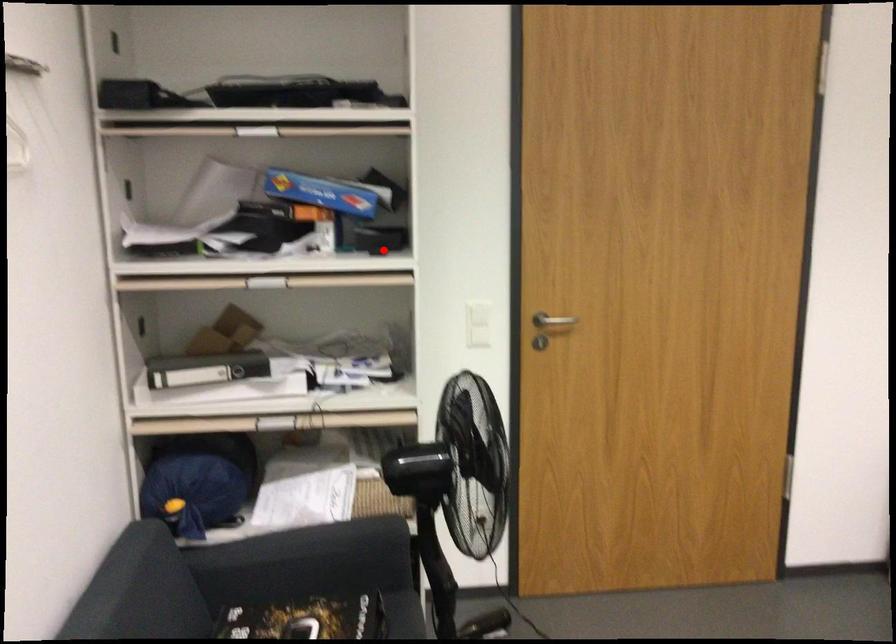
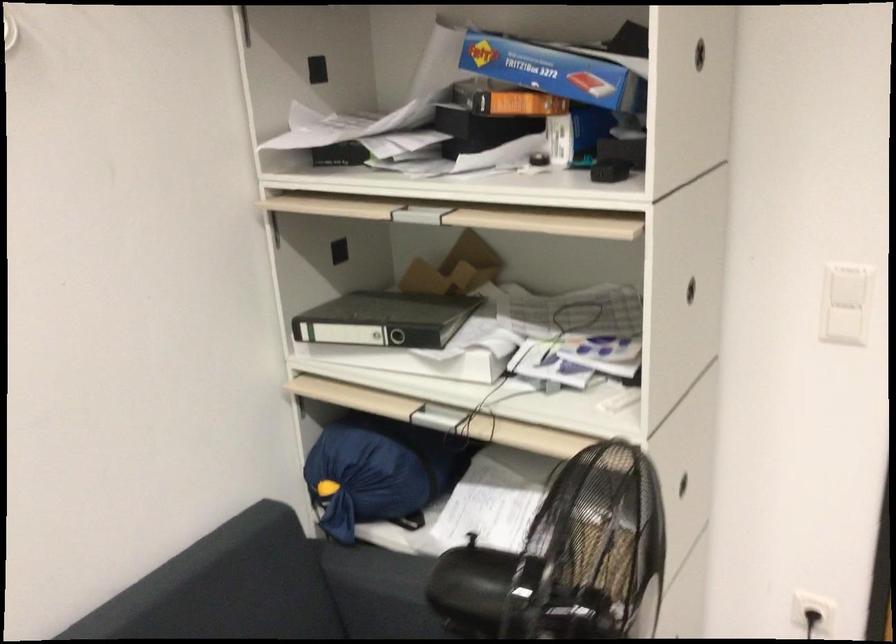
Question: A red point is marked in image1. In image2, is the corresponding 3D point closer to the camera or farther? Reply with the corresponding letter.

Choices:
 (A) The corresponding 3D point is closer.
 (B) The corresponding 3D point is farther.

Answer: (A)